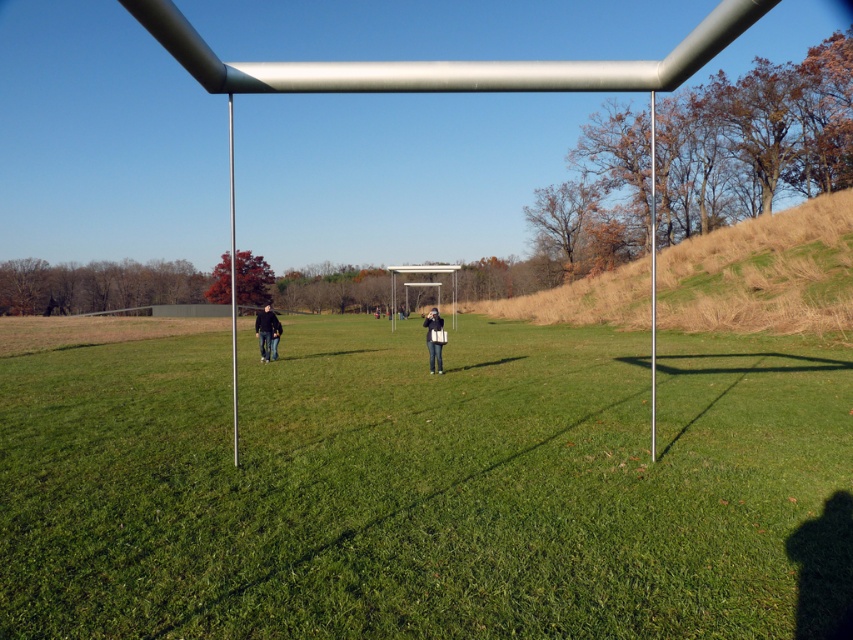
Question: Is dark blue jeans at left further to the viewer compared to denim jeans at center?

Choices:
 (A) yes
 (B) no

Answer: (A)

Question: Which point is closer to the camera?

Choices:
 (A) green grassy field at center
 (B) dark blue jeans at left
 (C) denim jeans at center

Answer: (A)

Question: Where is green grassy field at center located in relation to denim jeans at center in the image?

Choices:
 (A) right
 (B) left

Answer: (B)

Question: Which point is farther from the camera taking this photo?

Choices:
 (A) (273, 337)
 (B) (436, 316)
 (C) (320, 595)

Answer: (A)

Question: Is dark blue jeans at left smaller than denim jeans at center?

Choices:
 (A) yes
 (B) no

Answer: (B)

Question: Considering the real-world distances, which object is farthest from the dark blue jeans at left?

Choices:
 (A) denim jeans at center
 (B) green grassy field at center

Answer: (B)